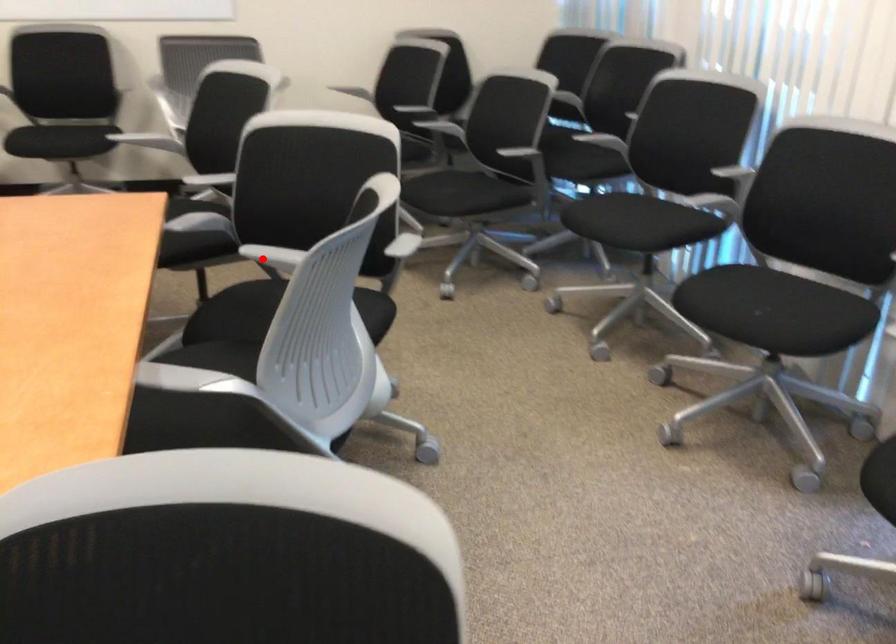
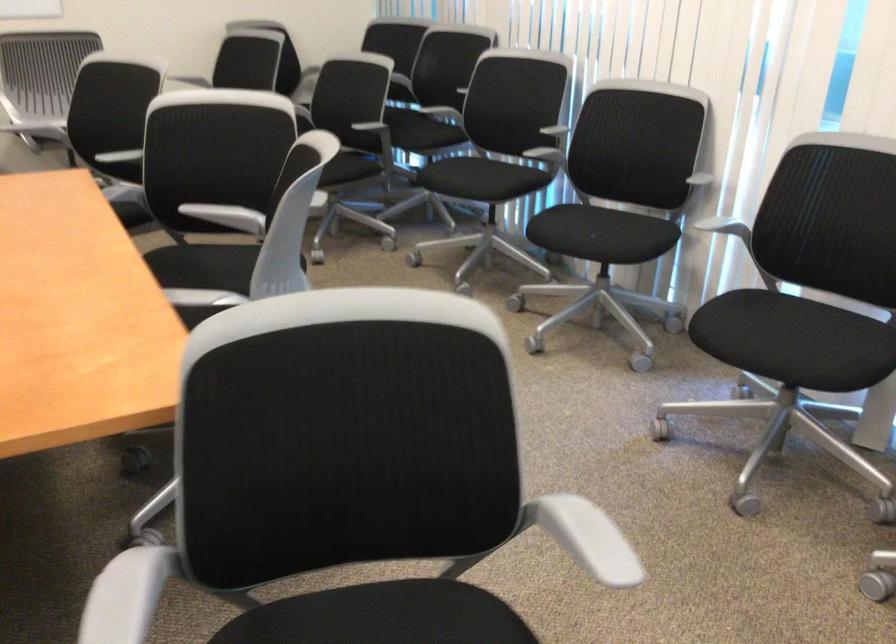
Question: I am providing you with two images of the same scene from different viewpoints. Given a red point in image1, look at the same physical point in image2. Is it:

Choices:
 (A) Closer to the viewpoint
 (B) Farther from the viewpoint

Answer: (B)